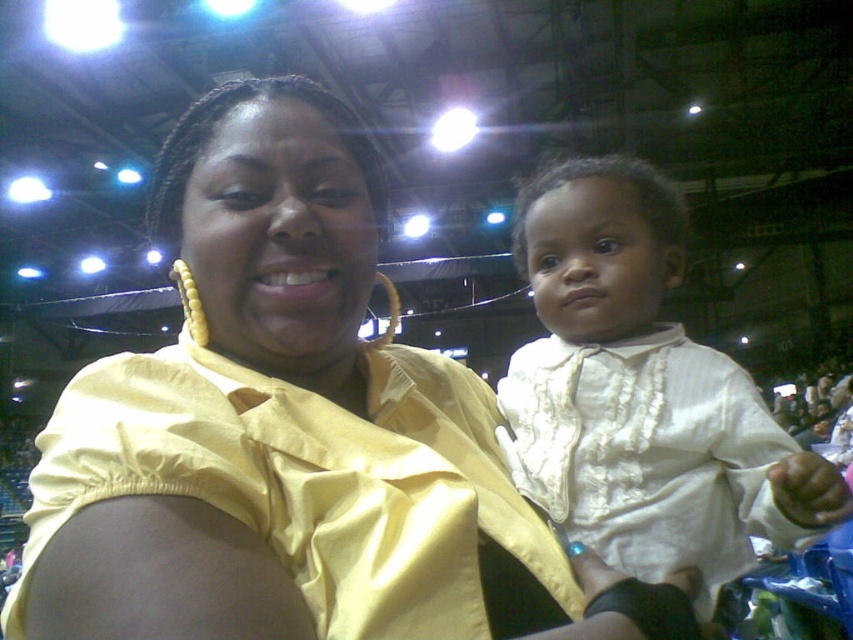
You are a photographer at a sports event and need to capture a photo of the yellow satin shirt at center and the white satin shirt at center. Based on their positions, which shirt should you focus on first to ensure both are in the frame?

The yellow satin shirt at center is below the white satin shirt at center, so you should focus on the white satin shirt at center first to ensure both are in the frame.

You are a photographer at a sports event and need to capture a photo of both the yellow satin shirt at center and the white satin shirt at center. Which shirt should you focus on first to ensure both are in frame?

The yellow satin shirt at center is taller than the white satin shirt at center, so you should focus on the yellow satin shirt at center first to ensure both are in frame.